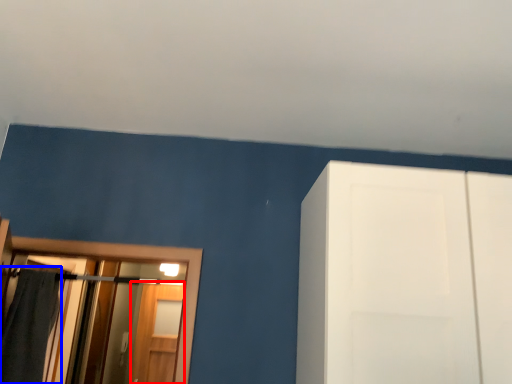
Question: Which object is further to the camera taking this photo, screen door (highlighted by a red box) or bath towel (highlighted by a blue box)?

Choices:
 (A) screen door
 (B) bath towel

Answer: (A)